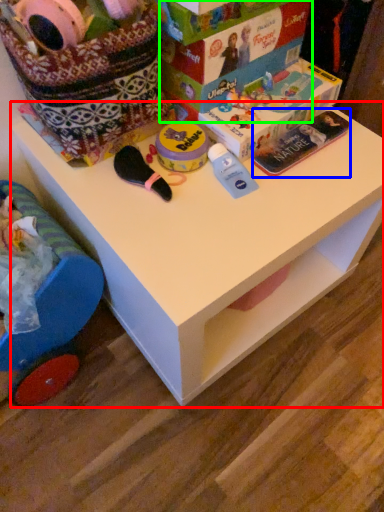
Question: Which is farther away from table (highlighted by a red box)? magazine (highlighted by a blue box) or storage box (highlighted by a green box)?

Choices:
 (A) magazine
 (B) storage box

Answer: (B)